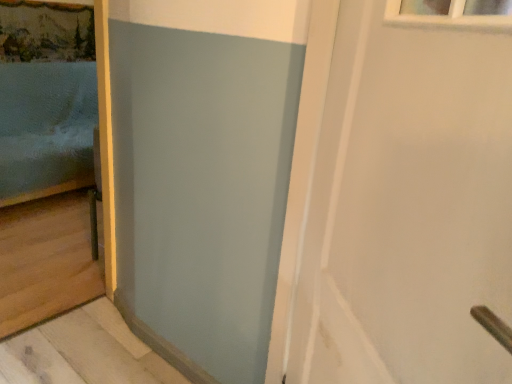
Question: From a real-world perspective, is white matte door at upper right located higher than matte blue bed at left?

Choices:
 (A) no
 (B) yes

Answer: (B)

Question: Is matte blue bed at left located within white matte door at upper right?

Choices:
 (A) no
 (B) yes

Answer: (A)

Question: Is white matte door at upper right behind matte blue bed at left?

Choices:
 (A) no
 (B) yes

Answer: (A)

Question: Is white matte door at upper right at the right side of matte blue bed at left?

Choices:
 (A) no
 (B) yes

Answer: (B)

Question: Does white matte door at upper right appear on the left side of matte blue bed at left?

Choices:
 (A) yes
 (B) no

Answer: (B)

Question: Is white matte door at upper right thinner than matte blue bed at left?

Choices:
 (A) no
 (B) yes

Answer: (B)

Question: From the image's perspective, is matte blue bed at left above white matte door at upper right?

Choices:
 (A) no
 (B) yes

Answer: (B)

Question: Does matte blue bed at left have a smaller size compared to white matte door at upper right?

Choices:
 (A) no
 (B) yes

Answer: (A)

Question: Does matte blue bed at left have a greater height compared to white matte door at upper right?

Choices:
 (A) yes
 (B) no

Answer: (A)

Question: Is matte blue bed at left outside white matte door at upper right?

Choices:
 (A) yes
 (B) no

Answer: (A)

Question: From the image's perspective, is matte blue bed at left beneath white matte door at upper right?

Choices:
 (A) no
 (B) yes

Answer: (A)

Question: Is matte blue bed at left shorter than white matte door at upper right?

Choices:
 (A) no
 (B) yes

Answer: (A)

Question: From a real-world perspective, is matte blue bed at left positioned above or below white matte door at upper right?

Choices:
 (A) above
 (B) below

Answer: (B)